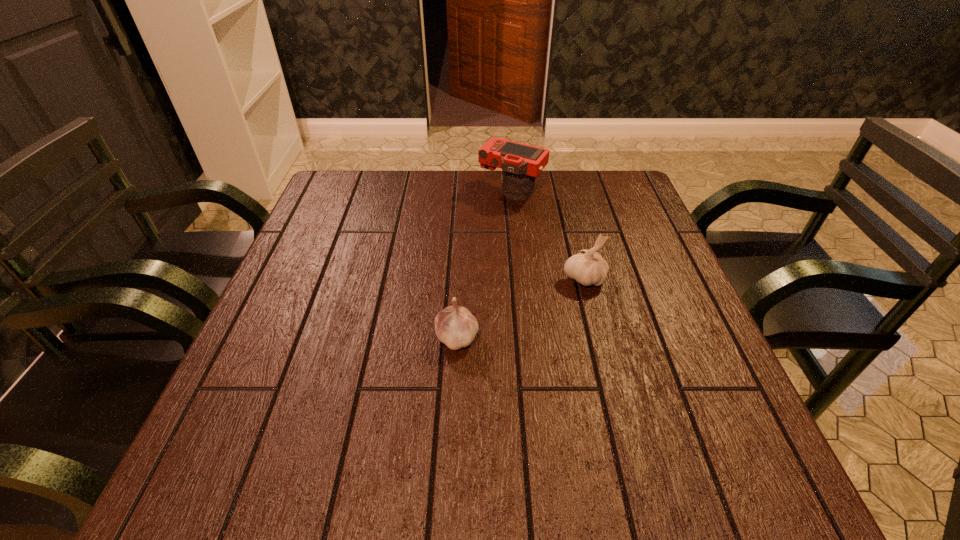
Locate an element on the screen. free spot between the camera and the nearest object is located at coordinates (485, 264).

You are a GUI agent. You are given a task and a screenshot of the screen. Output one action in this format:
    pyautogui.click(x=<x>, y=<y>)
    Task: Click on the vacant area that lies between the right garlic and the nearer garlic
    
    Given the screenshot: What is the action you would take?
    click(520, 308)

Locate an element on the screen. vacant space in between the nearer garlic and the right garlic is located at coordinates (520, 308).

This screenshot has width=960, height=540. I want to click on blank region between the farthest object and the right garlic, so click(548, 235).

I want to click on vacant area that lies between the farthest object and the nearest object, so click(485, 264).

Find the location of `free space between the left garlic and the second farthest object`. free space between the left garlic and the second farthest object is located at coordinates (520, 308).

Select which object is the closest to the camera. Please provide its 2D coordinates. Your answer should be formatted as a tuple, i.e. [(x, y)], where the tuple contains the x and y coordinates of a point satisfying the conditions above.

[(587, 267)]

Select which object is the closest to the second farthest object. Please provide its 2D coordinates. Your answer should be formatted as a tuple, i.e. [(x, y)], where the tuple contains the x and y coordinates of a point satisfying the conditions above.

[(455, 326)]

Identify the location of vacant space that satisfies the following two spatial constraints: 1. on the front side of the farthest object; 2. on the right side of the farther garlic. (520, 279).

Where is `vacant space that satisfies the following two spatial constraints: 1. on the back side of the camera; 2. on the right side of the nearest object`? vacant space that satisfies the following two spatial constraints: 1. on the back side of the camera; 2. on the right side of the nearest object is located at coordinates (464, 191).